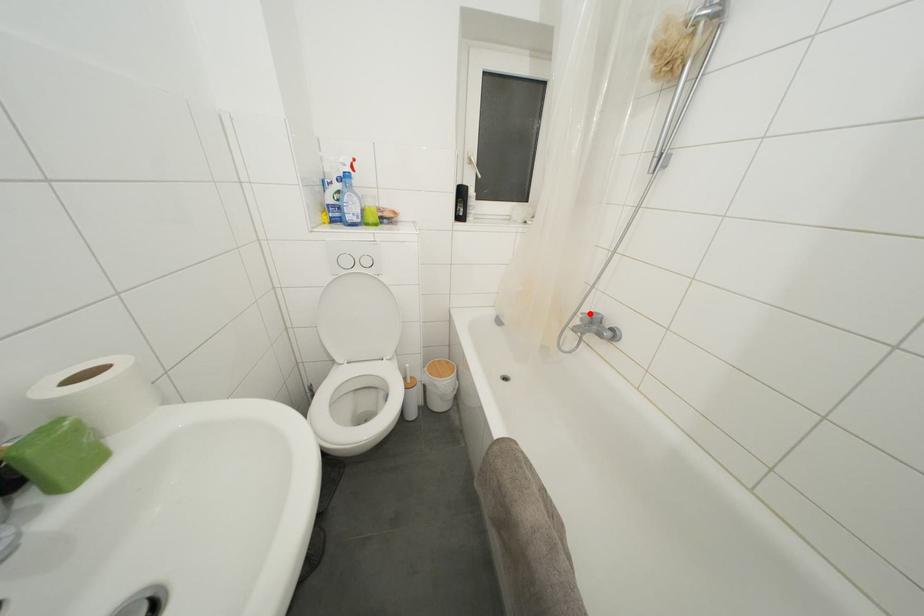
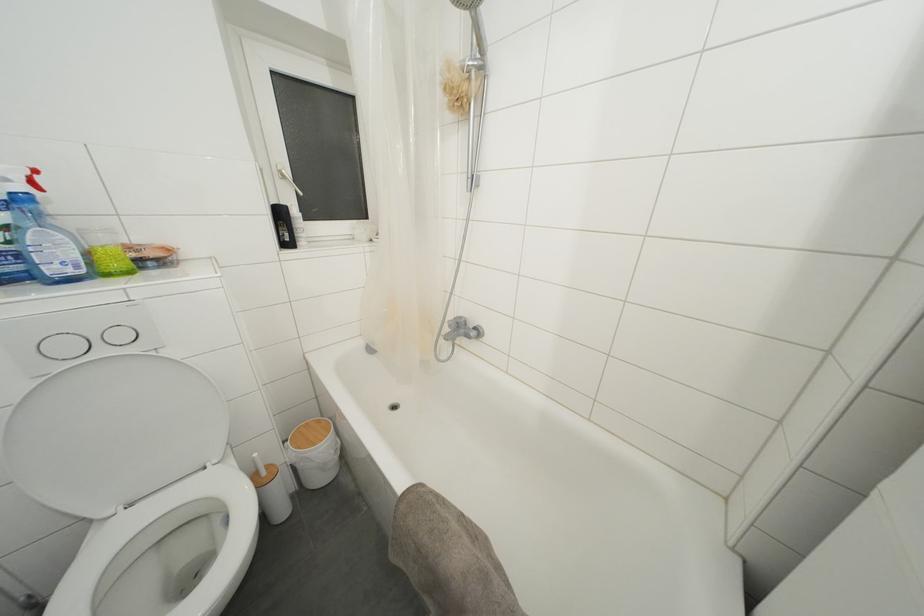
In the second image, find the point that corresponds to the highlighted location in the first image.

(455, 321)